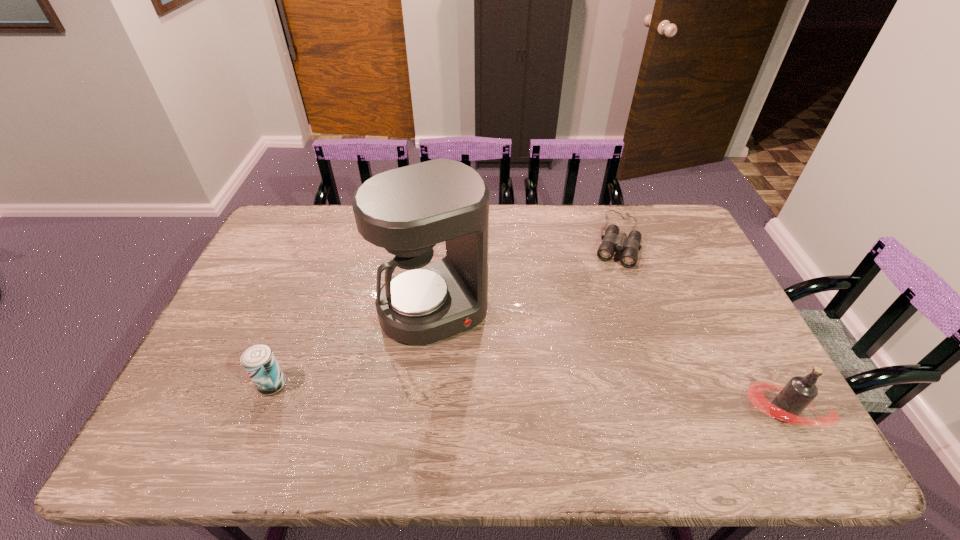
Find the location of a particular element. free space between the leftmost object and the third shortest object is located at coordinates (527, 399).

I want to click on free point between the root beer and the tallest object, so click(x=608, y=361).

Find the location of a particular element. vacant area between the third shortest object and the leftmost object is located at coordinates click(x=527, y=399).

Where is `vacant point located between the farthest object and the root beer`? vacant point located between the farthest object and the root beer is located at coordinates coord(699,326).

Image resolution: width=960 pixels, height=540 pixels. I want to click on object identified as the second closest to the third tallest object, so click(611, 241).

Choose which object is the third nearest neighbor to the farthest object. Please provide its 2D coordinates. Your answer should be formatted as a tuple, i.e. [(x, y)], where the tuple contains the x and y coordinates of a point satisfying the conditions above.

[(258, 360)]

At what (x,y) coordinates should I click in order to perform the action: click on vacant region that satisfies the following two spatial constraints: 1. on the front side of the root beer; 2. on the label of the third tallest object. Please return your answer as a coordinate pair (x, y). This screenshot has width=960, height=540. Looking at the image, I should click on (261, 413).

The width and height of the screenshot is (960, 540). Identify the location of free region that satisfies the following two spatial constraints: 1. on the front side of the second tallest object; 2. on the label of the leftmost object. (261, 413).